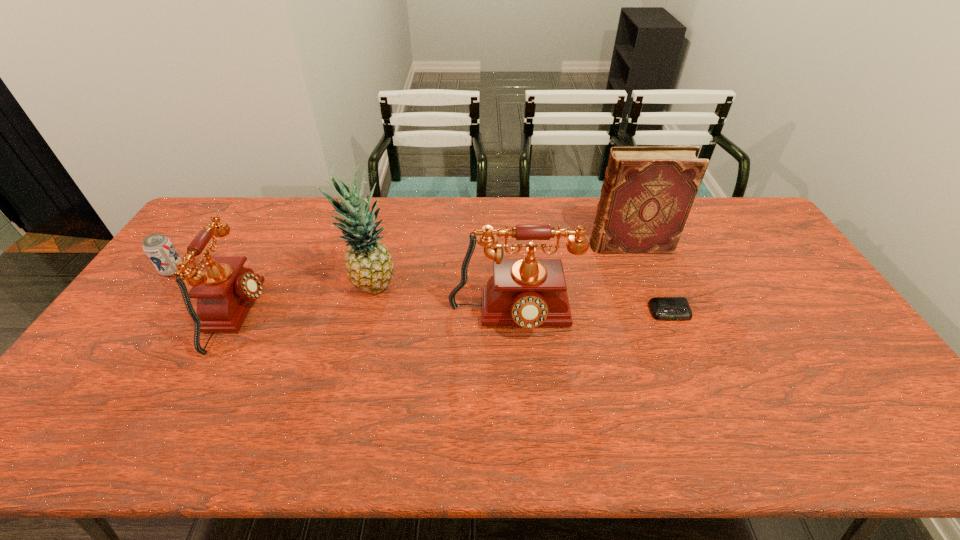
Locate an element on the screen. The height and width of the screenshot is (540, 960). vacant point at the near edge is located at coordinates (393, 379).

The height and width of the screenshot is (540, 960). I want to click on vacant area at the left edge, so click(x=127, y=323).

The height and width of the screenshot is (540, 960). In the image, there is a desktop. Find the location of `blank space at the right edge`. blank space at the right edge is located at coordinates (852, 368).

Locate an element on the screen. The image size is (960, 540). free region at the far left corner of the desktop is located at coordinates (228, 210).

What are the coordinates of `free space at the near left corner of the desktop` in the screenshot? It's located at (114, 383).

Image resolution: width=960 pixels, height=540 pixels. Find the location of `free space at the near right corner of the desktop`. free space at the near right corner of the desktop is located at coordinates (843, 377).

Locate an element on the screen. This screenshot has height=540, width=960. unoccupied position between the farthest object and the second object from left to right is located at coordinates tap(434, 280).

I want to click on free space between the beer can and the pineapple, so click(x=273, y=279).

The image size is (960, 540). Identify the location of vacant space in between the pineapple and the third shortest object. (305, 301).

Identify the location of vacant area that lies between the pineapple and the taller telephone. Image resolution: width=960 pixels, height=540 pixels. (443, 302).